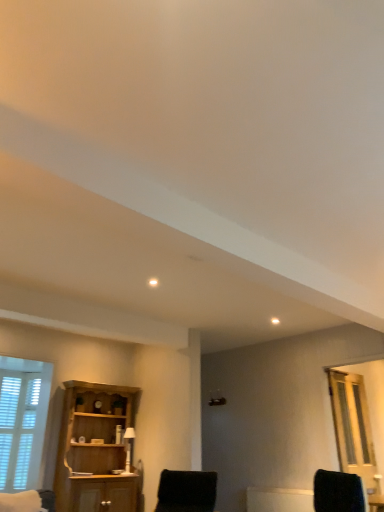
Describe the element at coordinates (353, 426) in the screenshot. I see `clear glass door at right` at that location.

Locate an element on the screen. This screenshot has width=384, height=512. white ceramic table lamp at center is located at coordinates (128, 447).

From the image's perspective, is wooden cabinet at left positioned above or below white wooden window at lower left?

From the image's perspective, wooden cabinet at left appears below white wooden window at lower left.

Is wooden cabinet at left oriented towards white wooden window at lower left?

No.

Between wooden cabinet at left and white wooden window at lower left, which one has more height?

With more height is white wooden window at lower left.

Is point (130, 482) positioned in front of point (24, 455)?

No, it is not.

Who is shorter, wooden cabinet at left or white ceramic table lamp at center?

With less height is white ceramic table lamp at center.

Relative to white ceramic table lamp at center, is wooden cabinet at left in front or behind?

Visually, wooden cabinet at left is located in front of white ceramic table lamp at center.

Considering the sizes of objects wooden cabinet at left and white ceramic table lamp at center in the image provided, who is bigger, wooden cabinet at left or white ceramic table lamp at center?

Bigger between the two is wooden cabinet at left.

Considering the positions of objects clear glass door at right and white wooden window at lower left in the image provided, who is more to the left, clear glass door at right or white wooden window at lower left?

From the viewer's perspective, white wooden window at lower left appears more on the left side.

Is clear glass door at right positioned beyond the bounds of white wooden window at lower left?

Yes, clear glass door at right is not within white wooden window at lower left.

Is clear glass door at right turned away from white wooden window at lower left?

No, white wooden window at lower left is not at the back of clear glass door at right.

How many degrees apart are the facing directions of clear glass door at right and white wooden window at lower left?

The angle between the facing direction of clear glass door at right and the facing direction of white wooden window at lower left is 0.179 degrees.

Where is `cupboard lying behind the white wooden window at lower left`? The height and width of the screenshot is (512, 384). cupboard lying behind the white wooden window at lower left is located at coordinates (94, 449).

Is white wooden window at lower left aimed at wooden cabinet at left?

No, white wooden window at lower left is not facing towards wooden cabinet at left.

Consider the image. What's the angular difference between white wooden window at lower left and wooden cabinet at left's facing directions?

1.19 degrees.

Is white wooden window at lower left surrounding wooden cabinet at left?

Definitely not — wooden cabinet at left is not inside white wooden window at lower left.

Consider the image. From the image's perspective, is white ceramic table lamp at center above or below clear glass door at right?

Clearly, from the image's perspective, white ceramic table lamp at center is below clear glass door at right.

Are white ceramic table lamp at center and clear glass door at right far apart?

Absolutely, white ceramic table lamp at center is distant from clear glass door at right.

Considering the relative sizes of white ceramic table lamp at center and clear glass door at right in the image provided, is white ceramic table lamp at center wider than clear glass door at right?

Yes, white ceramic table lamp at center is wider than clear glass door at right.

Is black fuzzy chair at lower center inside the boundaries of white ceramic table lamp at center, or outside?

black fuzzy chair at lower center cannot be found inside white ceramic table lamp at center.

Is black fuzzy chair at lower center facing away from white ceramic table lamp at center?

No, black fuzzy chair at lower center is not facing the opposite direction of white ceramic table lamp at center.

From a real-world perspective, between black fuzzy chair at lower center and white ceramic table lamp at center, who is vertically higher?

From a 3D spatial view, white ceramic table lamp at center is above.

Considering the relative positions of black fuzzy chair at lower center and white ceramic table lamp at center in the image provided, is black fuzzy chair at lower center to the left of white ceramic table lamp at center from the viewer's perspective?

No.

From a real-world perspective, which is physically above, clear glass door at right or white ceramic table lamp at center?

clear glass door at right, from a real-world perspective.

Does clear glass door at right contain white ceramic table lamp at center?

No, white ceramic table lamp at center is not surrounded by clear glass door at right.

Find the location of `glass door above the white ceramic table lamp at center (from a real-world perspective)`. glass door above the white ceramic table lamp at center (from a real-world perspective) is located at coordinates (353, 426).

Consider the image. Considering the positions of objects clear glass door at right and white ceramic table lamp at center in the image provided, who is more to the left, clear glass door at right or white ceramic table lamp at center?

Positioned to the left is white ceramic table lamp at center.

Where is `window in front of the wooden cabinet at left`? This screenshot has height=512, width=384. window in front of the wooden cabinet at left is located at coordinates (22, 420).

This screenshot has height=512, width=384. Identify the location of table lamp on the right of wooden cabinet at left. (128, 447).

Considering their positions, is white ceramic table lamp at center positioned further to white wooden window at lower left than clear glass door at right?

clear glass door at right is positioned further to the anchor white wooden window at lower left.

Estimate the real-world distances between objects in this image. Which object is closer to black fuzzy chair at lower center, white ceramic table lamp at center or clear glass door at right?

white ceramic table lamp at center is positioned closer to the anchor black fuzzy chair at lower center.

Looking at the image, which one is located closer to black fuzzy chair at lower center, wooden cabinet at left or white ceramic table lamp at center?

wooden cabinet at left.

Looking at the image, which one is located further to black fuzzy chair at lower center, white wooden window at lower left or white ceramic table lamp at center?

white wooden window at lower left.

Considering their positions, is wooden cabinet at left positioned further to black fuzzy chair at lower center than clear glass door at right?

clear glass door at right is further to black fuzzy chair at lower center.

From the image, which object appears to be farther from clear glass door at right, wooden cabinet at left or black fuzzy chair at lower center?

wooden cabinet at left.

Estimate the real-world distances between objects in this image. Which object is further from white ceramic table lamp at center, clear glass door at right or wooden cabinet at left?

Based on the image, clear glass door at right appears to be further to white ceramic table lamp at center.

Based on their spatial positions, is black fuzzy chair at lower center or white ceramic table lamp at center closer to clear glass door at right?

black fuzzy chair at lower center is closer to clear glass door at right.

Locate an element on the screen. chair located between wooden cabinet at left and clear glass door at right in the left-right direction is located at coordinates (187, 490).

Locate an element on the screen. This screenshot has width=384, height=512. cupboard between black fuzzy chair at lower center and white ceramic table lamp at center in the front-back direction is located at coordinates (94, 449).

You are a GUI agent. You are given a task and a screenshot of the screen. Output one action in this format:
    pyautogui.click(x=<x>, y=<y>)
    Task: Click on the table lamp located between wooden cabinet at left and clear glass door at right in the left-right direction
    The height and width of the screenshot is (512, 384).
    Given the screenshot: What is the action you would take?
    pyautogui.click(x=128, y=447)

The image size is (384, 512). What are the coordinates of `cupboard located between white wooden window at lower left and white ceramic table lamp at center in the left-right direction` in the screenshot? It's located at (94, 449).